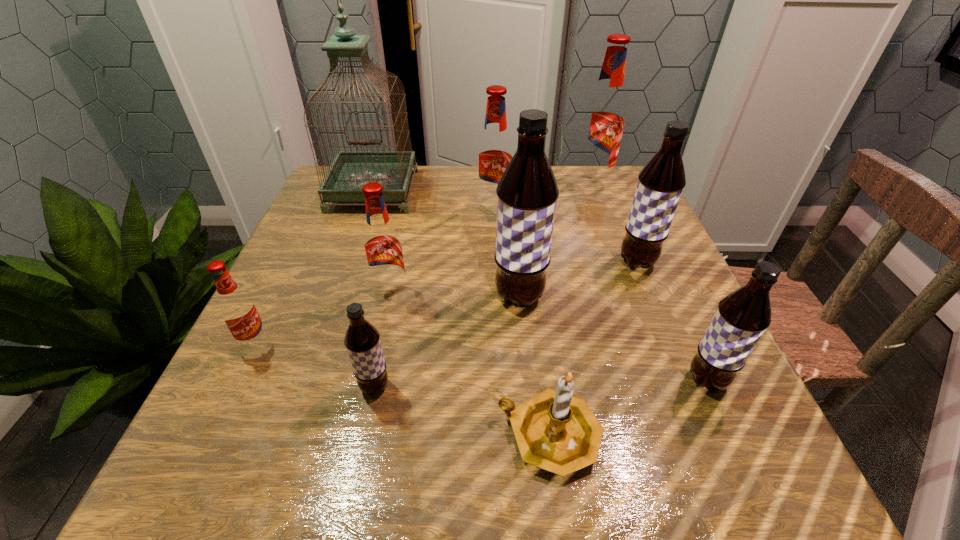
At what (x,y) coordinates should I click in order to perform the action: click on empty space between the second brown root beer from left to right and the smallest brown root beer. Please return your answer as a coordinate pair (x, y). Looking at the image, I should click on (447, 342).

The height and width of the screenshot is (540, 960). I want to click on vacant space that is in between the third smallest brown root beer and the biggest red root beer, so click(614, 223).

This screenshot has width=960, height=540. I want to click on blank region between the fourth farthest object and the shortest object, so click(593, 349).

Identify the location of free space between the second biggest brown root beer and the gold candle holder. (593, 349).

Where is `free space between the biggest brown root beer and the leftmost brown root beer`? Image resolution: width=960 pixels, height=540 pixels. free space between the biggest brown root beer and the leftmost brown root beer is located at coordinates (447, 342).

Identify the location of free point between the sixth farthest root beer and the fourth farthest object. (446, 302).

Where is `free space between the candle holder and the third biggest brown root beer`? The height and width of the screenshot is (540, 960). free space between the candle holder and the third biggest brown root beer is located at coordinates click(628, 408).

Locate an element on the screen. the sixth closest object to the leftmost red root beer is located at coordinates (494, 153).

Select which object is the fifth closest to the third red root beer from right to left. Please provide its 2D coordinates. Your answer should be formatted as a tuple, i.e. [(x, y)], where the tuple contains the x and y coordinates of a point satisfying the conditions above.

[(350, 170)]

Locate which root beer ranks sixth in proximity to the third biggest brown root beer. Please provide its 2D coordinates. Your answer should be formatted as a tuple, i.e. [(x, y)], where the tuple contains the x and y coordinates of a point satisfying the conditions above.

[(603, 122)]